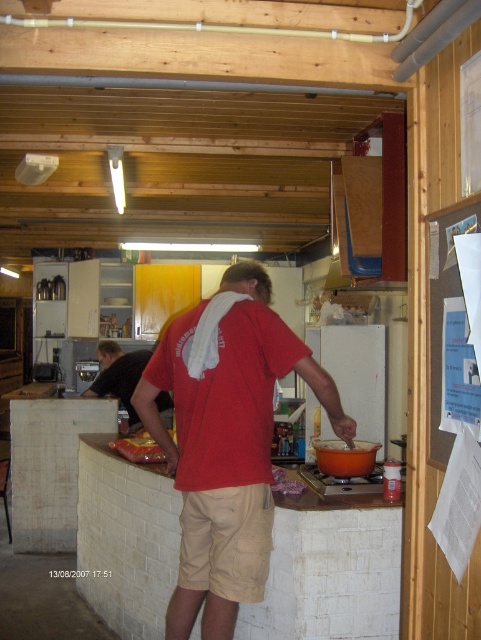
You are trying to decide whether to hang a decorative item on the red matte shirt at center or the white paperboard at right. Based on their sizes, which surface can accommodate a wider item?

The red matte shirt at center might be wider than white paperboard at right, so it can accommodate a wider decorative item.

You are organizing a picnic and need to decide between using the white paperboard at right and the shiny plastic bag at counter left to carry sandwiches. Which item is more suitable for stacking multiple layers of sandwiches without bending?

The shiny plastic bag at counter left is more suitable for stacking multiple layers of sandwiches without bending because it is thicker than the white paperboard at right.

Consider the image. You are a guest in this kitchen and need to place a small plate on the white paperboard at right without blocking the red matte shirt at center. Is this possible?

The white paperboard at right is behind the red matte shirt at center, so placing the plate on the white paperboard at right would not block the red matte shirt at center.